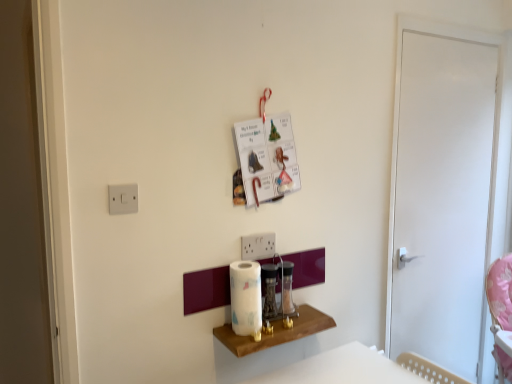
You are a GUI agent. You are given a task and a screenshot of the screen. Output one action in this format:
    pyautogui.click(x=<x>, y=<y>)
    Task: Click on the vacant area to the right of white glossy paper towel at center
    Image resolution: width=512 pixels, height=384 pixels.
    Given the screenshot: What is the action you would take?
    pyautogui.click(x=291, y=321)